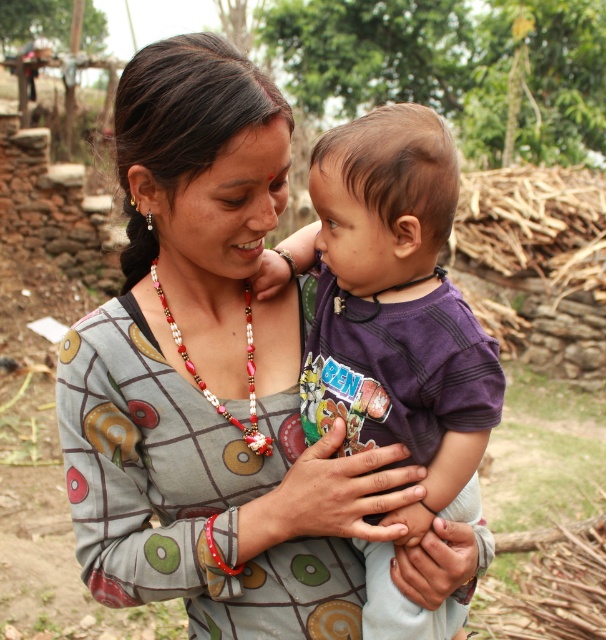
Looking at the scene, which object is positioned higher up between the purple cotton shirt at center and the beaded necklace at center?

The purple cotton shirt at center is taller than the beaded necklace at center, so the purple cotton shirt at center is positioned higher up.

You are a photographer taking a picture of the scene. You notice two points in the image labeled as point 1 and point 2. Point 1 is at coordinate (x=268, y=465) and point 2 is at coordinate (x=367, y=284). Which point is closer to the camera?

Point 1 at coordinate (x=268, y=465) is closer to the camera than point 2 at coordinate (x=367, y=284) because the description states that point (x=268, y=465) is further to the camera than point (x=367, y=284).